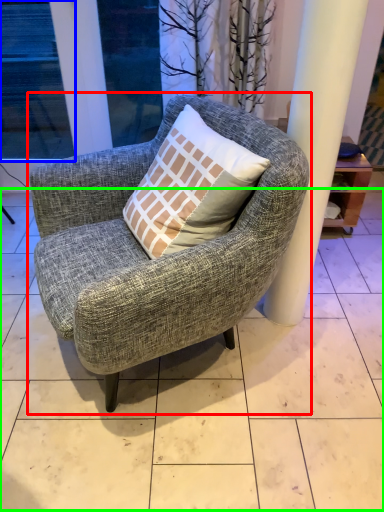
Question: Based on their relative distances, which object is farther from chair (highlighted by a red box)? Choose from window (highlighted by a blue box) and tile (highlighted by a green box).

Choices:
 (A) window
 (B) tile

Answer: (A)